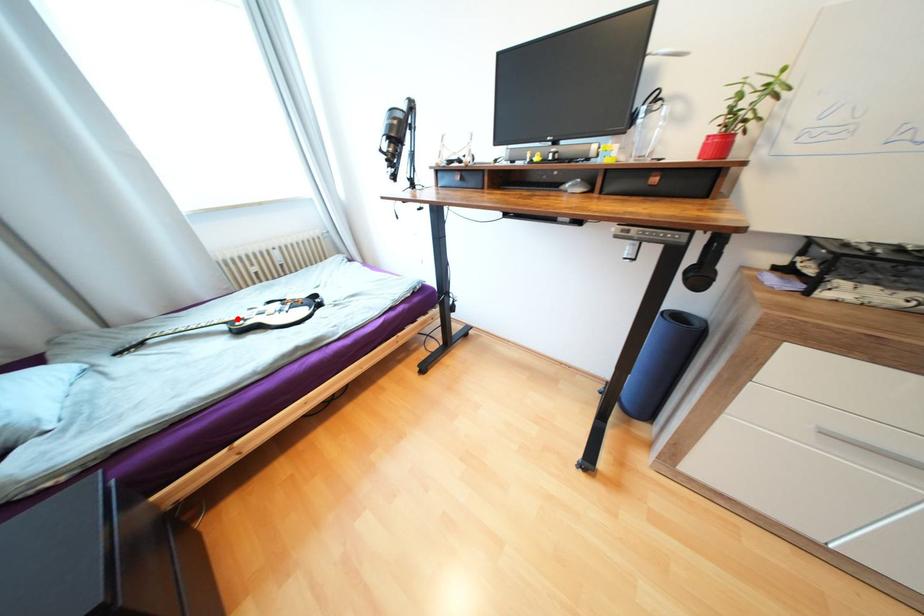
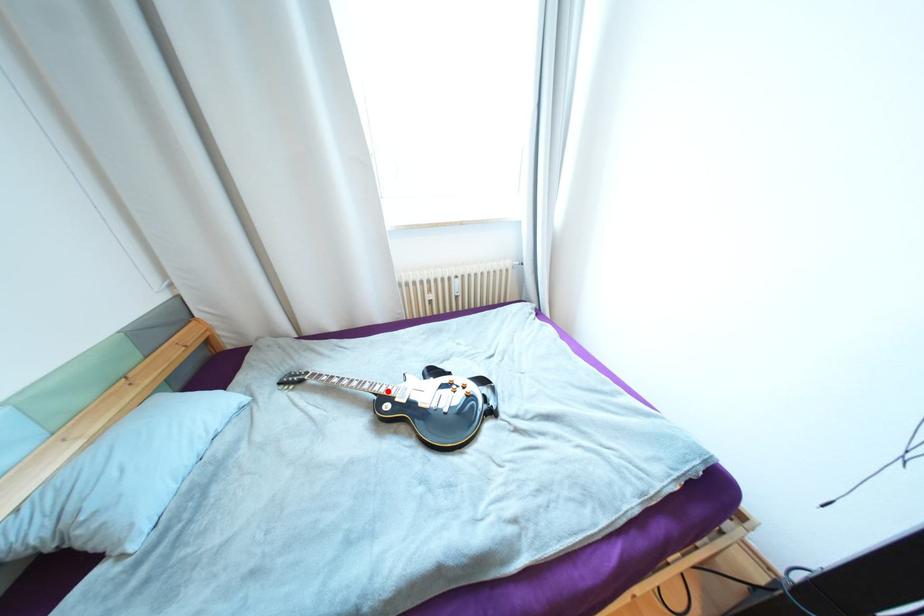
I am providing you with two images of the same scene from different viewpoints. A red point is marked on the first image and another point is marked on the second image. Are the points marked in image1 and image2 representing the same 3D position?

Yes